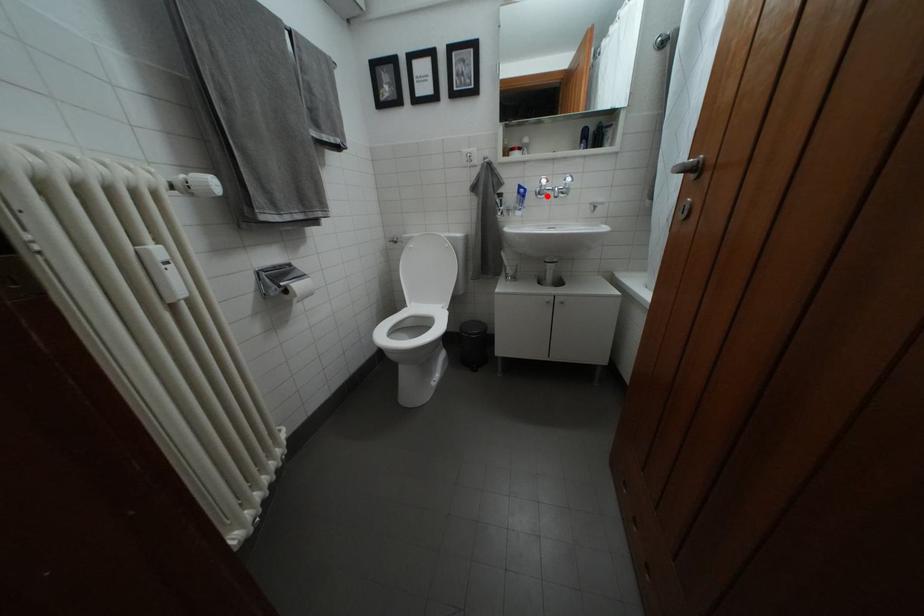
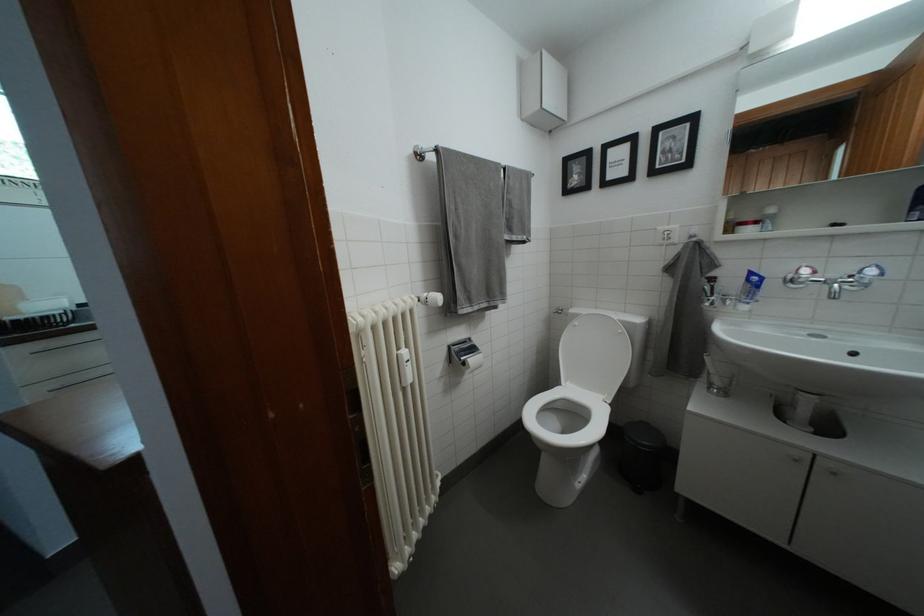
Locate, in the second image, the point that corresponds to the highlighted location in the first image.

(799, 282)